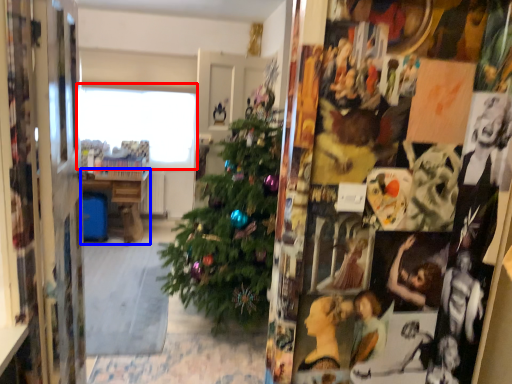
Question: Which point is closer to the camera, window (highlighted by a red box) or table (highlighted by a blue box)?

Choices:
 (A) window
 (B) table

Answer: (A)